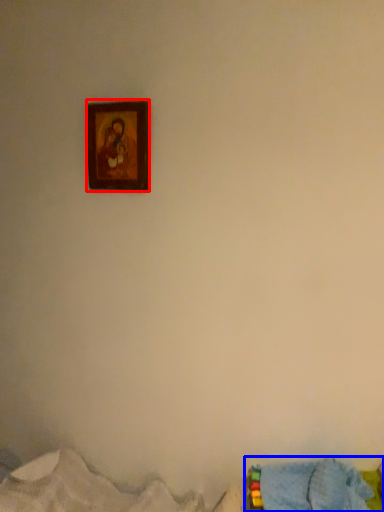
Question: Among these objects, which one is nearest to the camera, picture frame (highlighted by a red box) or bed (highlighted by a blue box)?

Choices:
 (A) picture frame
 (B) bed

Answer: (B)